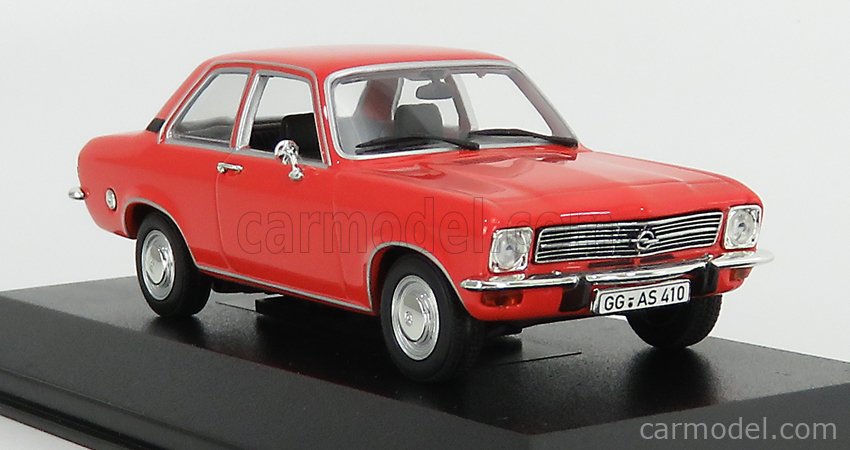
This screenshot has height=450, width=850. I want to click on plain, cream background, so click(60, 100).